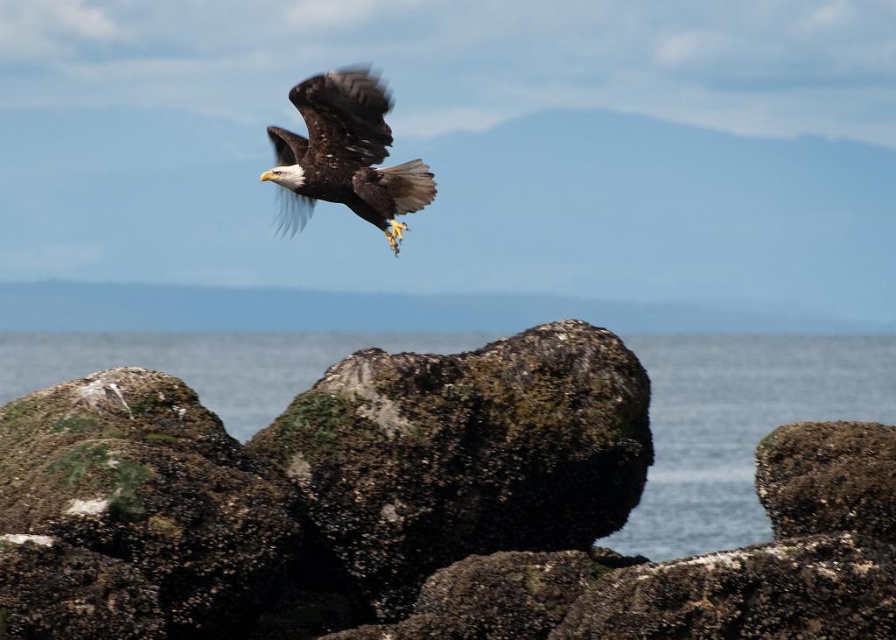
Question: Can you confirm if transparent water at center is smaller than brown feathered eagle at upper center?

Choices:
 (A) no
 (B) yes

Answer: (A)

Question: Which point appears closest to the camera in this image?

Choices:
 (A) (704, 497)
 (B) (337, 116)
 (C) (440, 420)

Answer: (C)

Question: Does mossy rock at center lie in front of brown feathered eagle at upper center?

Choices:
 (A) yes
 (B) no

Answer: (A)

Question: Does transparent water at center have a smaller size compared to brown feathered eagle at upper center?

Choices:
 (A) no
 (B) yes

Answer: (A)

Question: Estimate the real-world distances between objects in this image. Which object is farther from the brown feathered eagle at upper center?

Choices:
 (A) mossy rock at center
 (B) transparent water at center

Answer: (B)

Question: Among these objects, which one is farthest from the camera?

Choices:
 (A) transparent water at center
 (B) mossy rock at center
 (C) brown feathered eagle at upper center

Answer: (A)